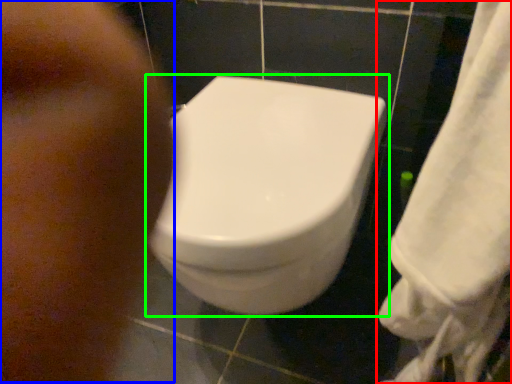
Question: Which object is positioned closest to towel (highlighted by a red box)? Select from face (highlighted by a blue box) and toilet (highlighted by a green box).

Choices:
 (A) face
 (B) toilet

Answer: (B)